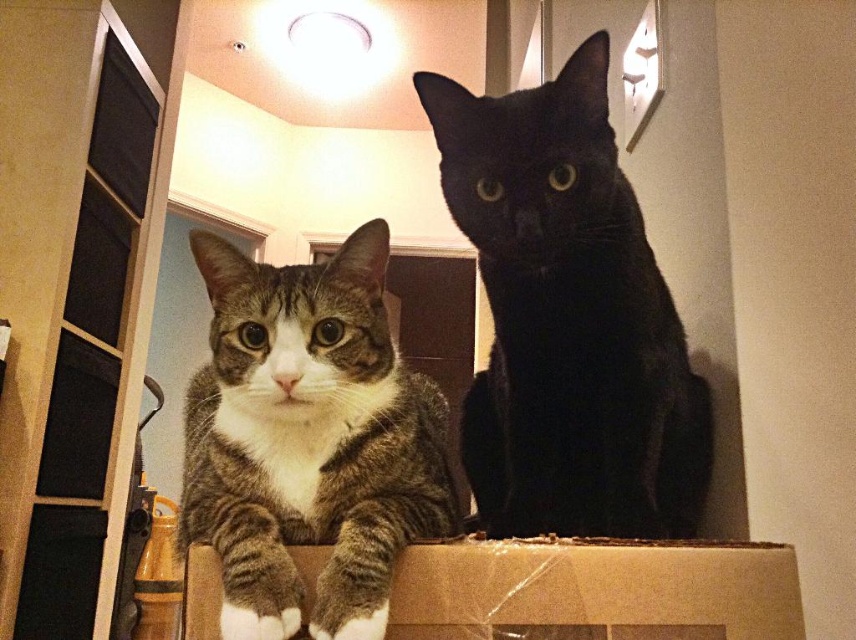
Between point (538, 108) and point (756, 637), which one is positioned behind?

Positioned behind is point (538, 108).

Which of these two, black glossy cat at upper center or brown cardboard box at center, stands taller?

black glossy cat at upper center

Does point (538, 509) come in front of point (403, 573)?

No, it is not.

Locate an element on the screen. The image size is (856, 640). black glossy cat at upper center is located at coordinates (568, 317).

Who is positioned more to the right, black glossy cat at upper center or tabby fur cat at center?

black glossy cat at upper center

Which is above, black glossy cat at upper center or tabby fur cat at center?

black glossy cat at upper center is above.

Which is behind, point (484, 273) or point (235, 612)?

Point (484, 273)

Identify the location of black glossy cat at upper center. (568, 317).

Who is higher up, tabby fur cat at center or brown cardboard box at center?

tabby fur cat at center is higher up.

Which is more to the right, tabby fur cat at center or brown cardboard box at center?

brown cardboard box at center

Who is more distant from viewer, (189, 465) or (625, 593)?

The point (189, 465) is behind.

You are a GUI agent. You are given a task and a screenshot of the screen. Output one action in this format:
    pyautogui.click(x=<x>, y=<y>)
    Task: Click on the tabby fur cat at center
    This screenshot has width=856, height=640.
    Given the screenshot: What is the action you would take?
    pyautogui.click(x=308, y=440)